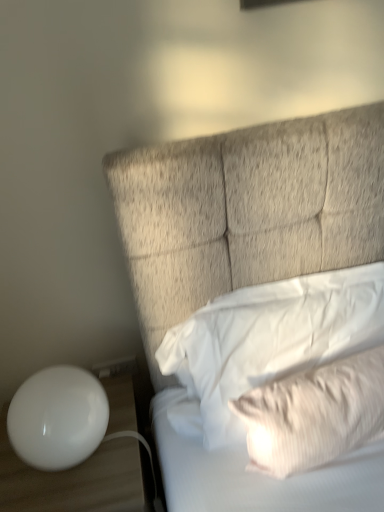
Where is `vacant space underneath white glossy sphere at lower left (from a real-world perspective)`? The height and width of the screenshot is (512, 384). vacant space underneath white glossy sphere at lower left (from a real-world perspective) is located at coordinates (70, 465).